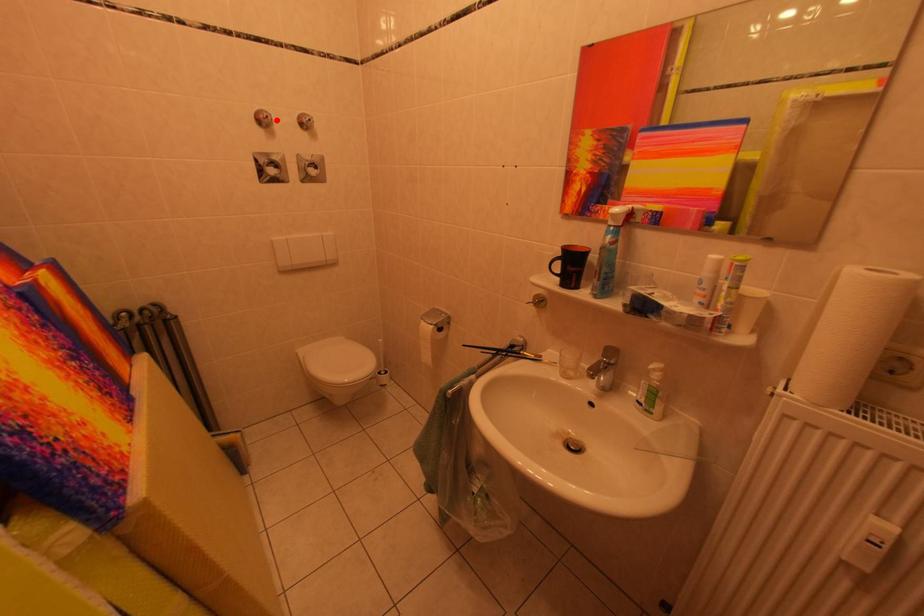
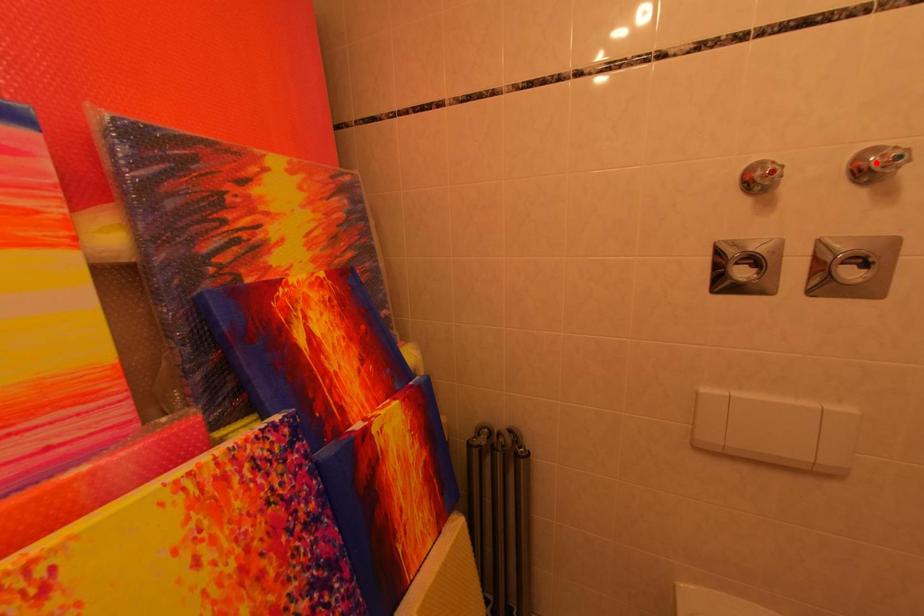
I am providing you with two images of the same scene from different viewpoints. A red point is marked on the first image and another point is marked on the second image. Do the highlighted points in image1 and image2 indicate the same real-world spot?

No